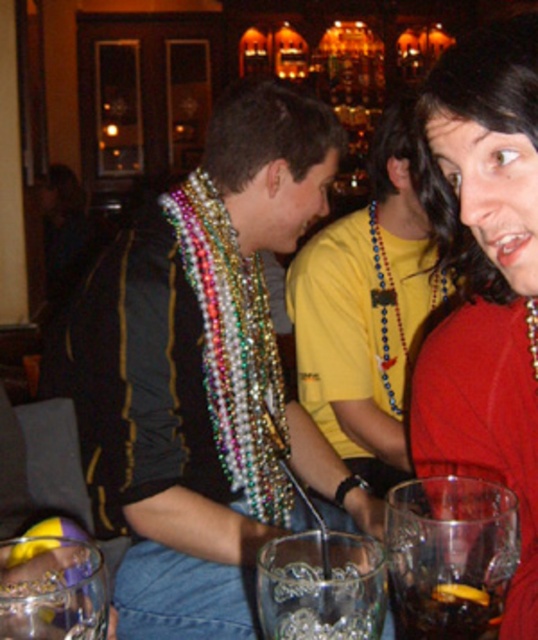
Question: Does clear glass wine glass at lower right appear on the left side of clear glass at center?

Choices:
 (A) yes
 (B) no

Answer: (B)

Question: Which object is closer to the camera taking this photo?

Choices:
 (A) multicolored beaded necklace at center
 (B) clear glass at center
 (C) dark brown liquid at center
 (D) matte red dress at center

Answer: (B)

Question: Which object is positioned farthest from the matte red dress at center?

Choices:
 (A) clear glass wine glass at lower right
 (B) clear glass at center

Answer: (B)

Question: Does multicolored beaded necklace at center appear over clear glass wine glass at lower right?

Choices:
 (A) yes
 (B) no

Answer: (A)

Question: Observing the image, what is the correct spatial positioning of clear glass at center in reference to clear glass wine glass at lower left?

Choices:
 (A) right
 (B) left

Answer: (A)

Question: Which of the following is the closest to the observer?

Choices:
 (A) clear glass wine glass at lower right
 (B) matte red dress at center
 (C) dark brown liquid at center
 (D) multicolored beaded necklace at center

Answer: (A)